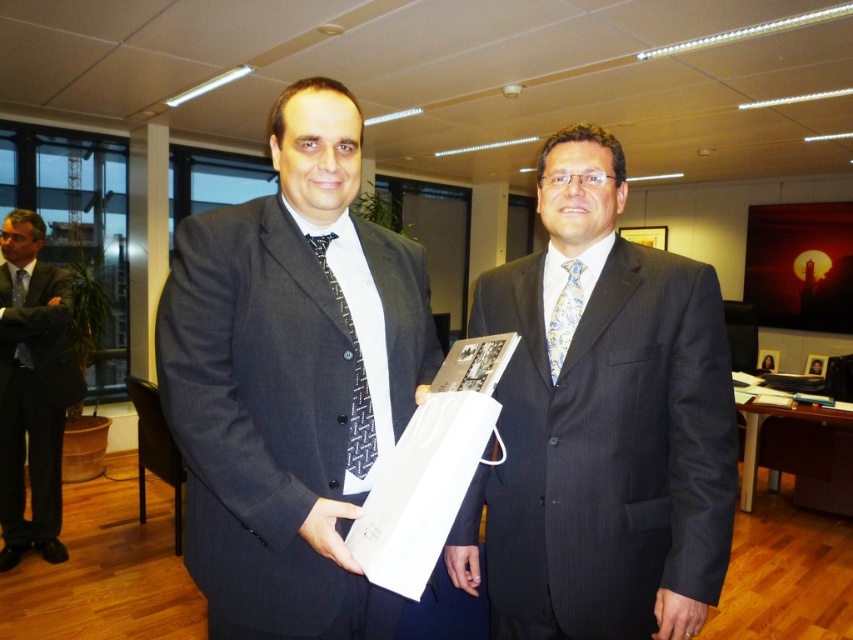
Question: Can you confirm if dark gray suit at center is positioned to the left of light blue floral silk tie at center?

Choices:
 (A) no
 (B) yes

Answer: (B)

Question: Considering the real-world distances, which object is farthest from the matte black tie at left?

Choices:
 (A) black textured tie at center
 (B) dark gray suit at center

Answer: (A)

Question: Can you confirm if dark gray pinstripe suit at center is positioned above light blue floral silk tie at center?

Choices:
 (A) yes
 (B) no

Answer: (B)

Question: Does black suit at left have a larger size compared to matte black tie at left?

Choices:
 (A) yes
 (B) no

Answer: (A)

Question: Which point appears farthest from the camera in this image?

Choices:
 (A) (355, 385)
 (B) (32, 500)
 (C) (563, 268)
 (D) (357, 454)

Answer: (B)

Question: Which object appears farthest from the camera in this image?

Choices:
 (A) black suit at left
 (B) dark gray pinstripe suit at center

Answer: (A)